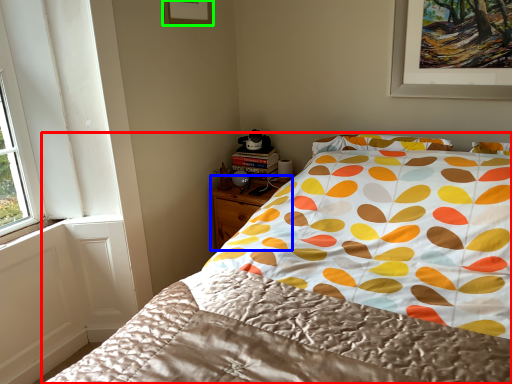
Question: Estimate the real-world distances between objects in this image. Which object is closer to bed (highlighted by a red box), nightstand (highlighted by a blue box) or picture frame (highlighted by a green box)?

Choices:
 (A) nightstand
 (B) picture frame

Answer: (A)